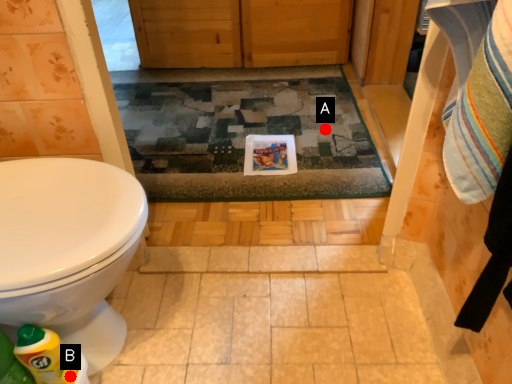
Question: Two points are circled on the image, labeled by A and B beside each circle. Which point is further to the camera?

Choices:
 (A) A is further
 (B) B is further

Answer: (A)